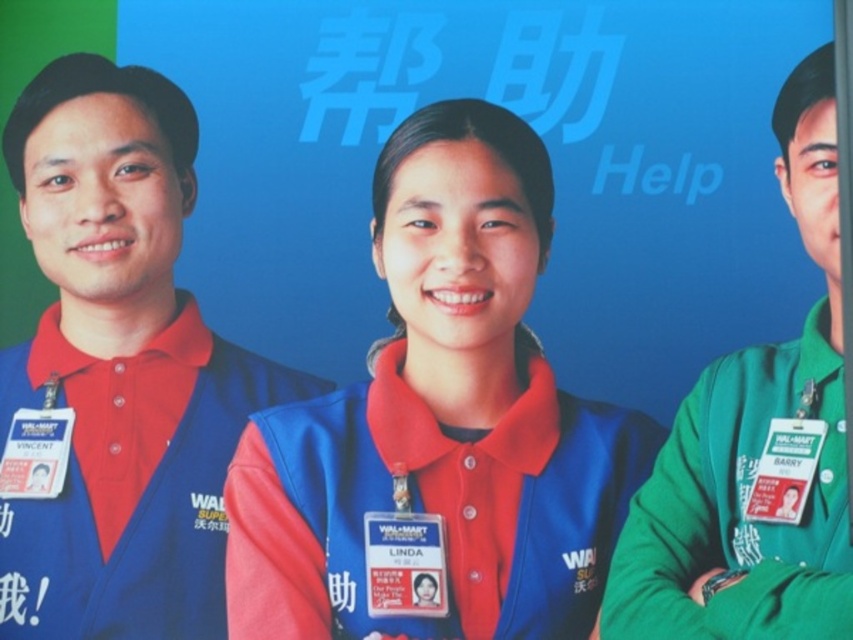
You are a customer at Walmart and see the three employees standing against the blue background. You notice the green fabric shirt at right and the white plastic badge at right. Which item is covering the other?

The green fabric shirt at right is positioned over the white plastic badge at right, so the shirt is covering the badge.

You are a customer at Walmart and see the three employees standing against the blue background. You notice a green fabric shirt at right and a white plastic badge at right. Which one is located more to the right side?

The green fabric shirt at right is positioned on the right side of the white plastic badge at right, so the green fabric shirt at right is more to the right side.

You are a customer at Walmart who needs to locate a specific item in the store. You see the blue fabric vest at center and the white plastic badge at left. Which item would be more effective for asking for help?

The blue fabric vest at center is larger in size than the white plastic badge at left, so it would be more noticeable and thus more effective for asking for help.